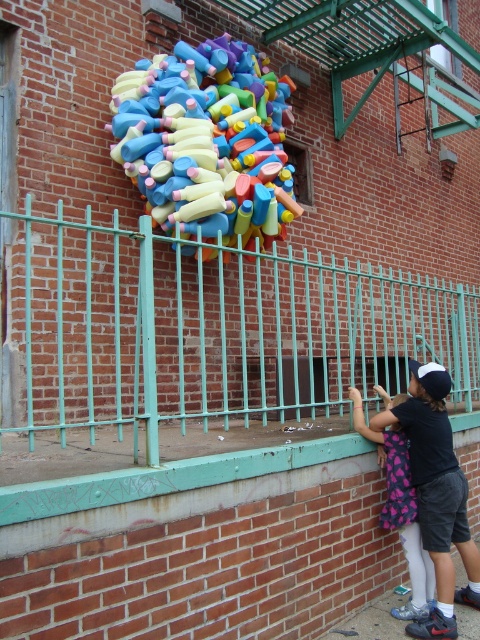
Does multicolored plastic bottles at center lie in front of black cotton shirt at lower right?

No, multicolored plastic bottles at center is further to the viewer.

Which of these two, multicolored plastic bottles at center or black cotton shirt at lower right, stands taller?

multicolored plastic bottles at center is taller.

I want to click on multicolored plastic bottles at center, so click(205, 144).

Does teal metal fence at center appear under black cotton shirt at lower right?

Actually, teal metal fence at center is above black cotton shirt at lower right.

Is point (146, 452) positioned in front of point (444, 616)?

That is True.

In order to click on teal metal fence at center in this screenshot , I will do `click(213, 330)`.

Identify the location of teal metal fence at center. (213, 330).

Does teal metal fence at center have a lesser height compared to multicolored plastic bottles at center?

Correct, teal metal fence at center is not as tall as multicolored plastic bottles at center.

Is teal metal fence at center further to camera compared to multicolored plastic bottles at center?

No, it is not.

Identify the location of teal metal fence at center. The height and width of the screenshot is (640, 480). (213, 330).

The height and width of the screenshot is (640, 480). I want to click on teal metal fence at center, so click(x=213, y=330).